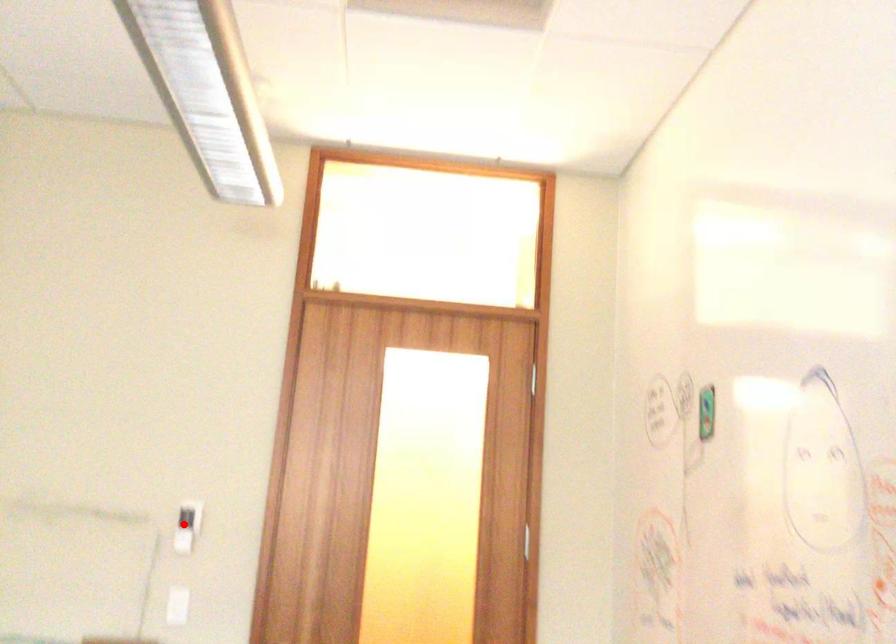
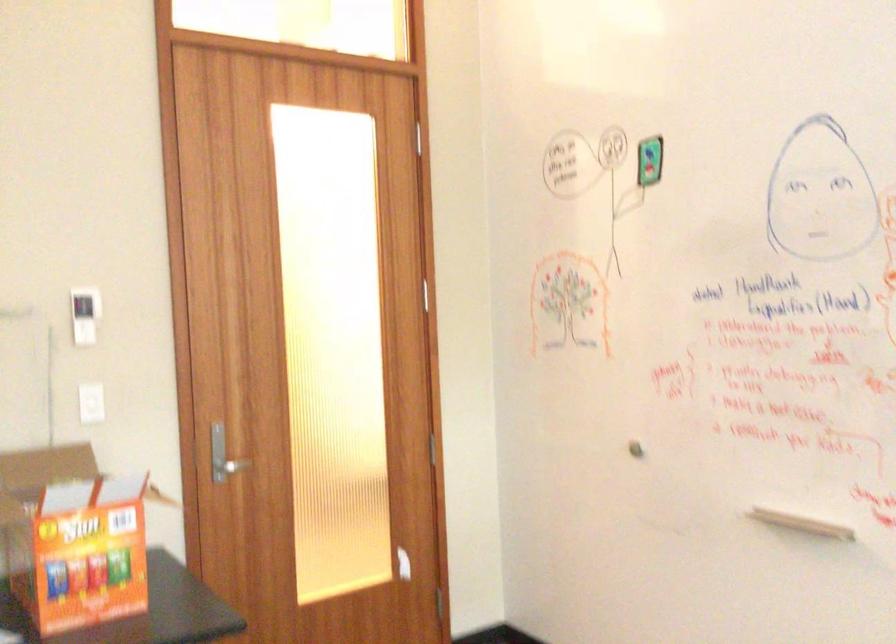
Question: I am providing you with two images of the same scene from different viewpoints. Image1 has a red point marked. In image2, the corresponding 3D location appears at what relative position? Reply with the corresponding letter.

Choices:
 (A) Closer
 (B) Farther

Answer: (A)